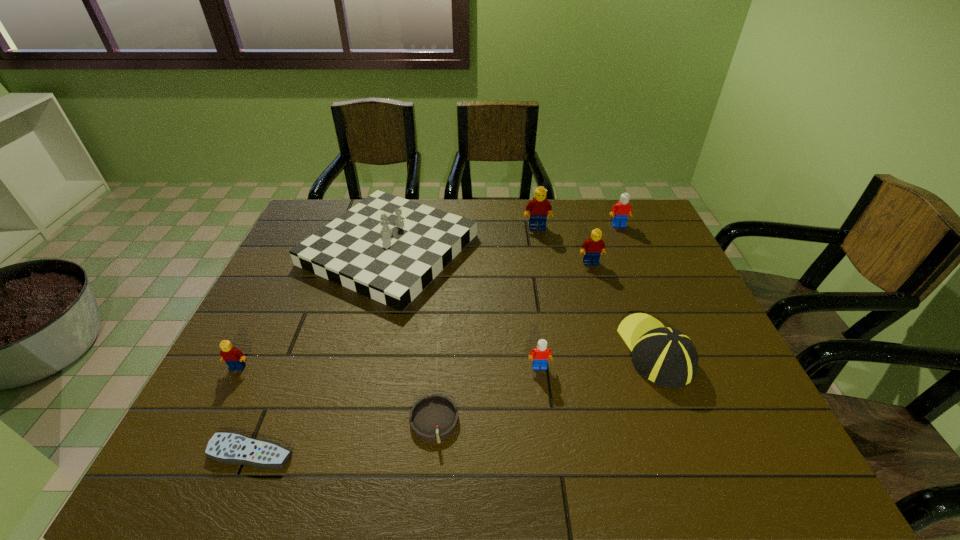
I want to click on the second yellow Lego from right to left, so click(x=540, y=208).

What are the coordinates of `the farthest yellow Lego` in the screenshot? It's located at click(x=540, y=208).

Locate an element on the screen. The width and height of the screenshot is (960, 540). checkerboard is located at coordinates (387, 248).

The height and width of the screenshot is (540, 960). Find the location of `the rightmost Lego`. the rightmost Lego is located at coordinates (622, 210).

Find the location of a particular element. the farther white Lego is located at coordinates (622, 210).

Locate an element on the screen. The image size is (960, 540). the second Lego from right to left is located at coordinates (592, 248).

Image resolution: width=960 pixels, height=540 pixels. What are the coordinates of `the third nearest Lego` in the screenshot? It's located at (592, 248).

This screenshot has height=540, width=960. Find the location of `baseball cap`. baseball cap is located at coordinates (665, 356).

Identify the location of the smallest yellow Lego. The width and height of the screenshot is (960, 540). (233, 357).

Identify the location of the leftmost yellow Lego. (233, 357).